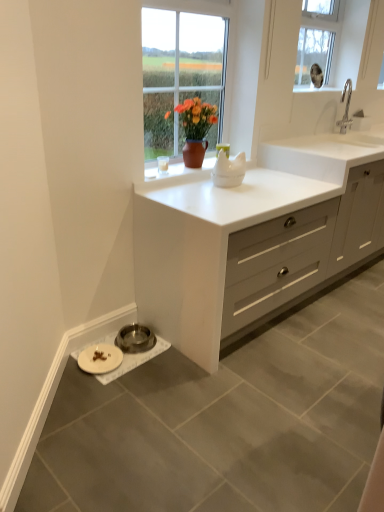
At what (x,y) coordinates should I click in order to perform the action: click on vacant space situated above white matte cabinet at center (from a real-world perspective). Please return your answer as a coordinate pair (x, y). The image size is (384, 512). Looking at the image, I should click on (254, 187).